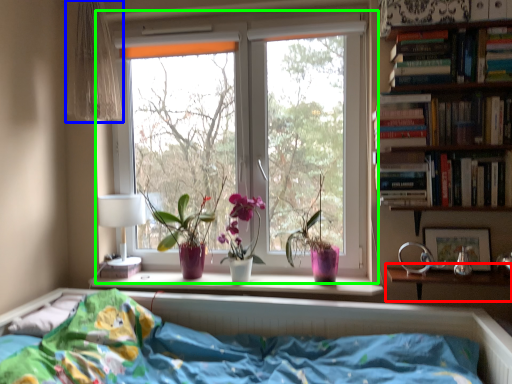
Question: Which object is positioned closest to table (highlighted by a red box)? Select from curtain (highlighted by a blue box) and window (highlighted by a green box).

Choices:
 (A) curtain
 (B) window

Answer: (B)